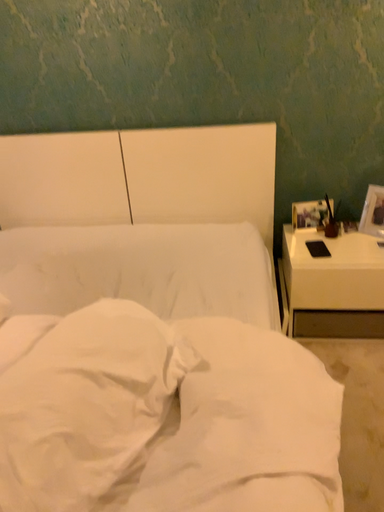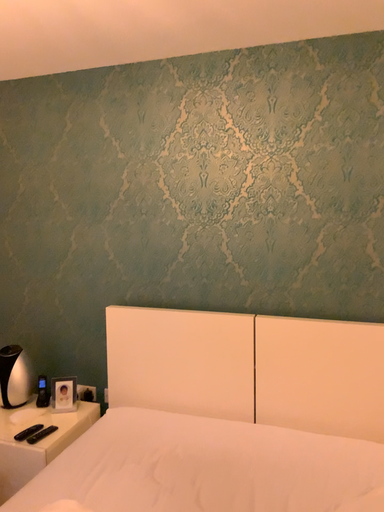
Question: How did the camera likely rotate when shooting the video?

Choices:
 (A) rotated left
 (B) rotated right

Answer: (A)